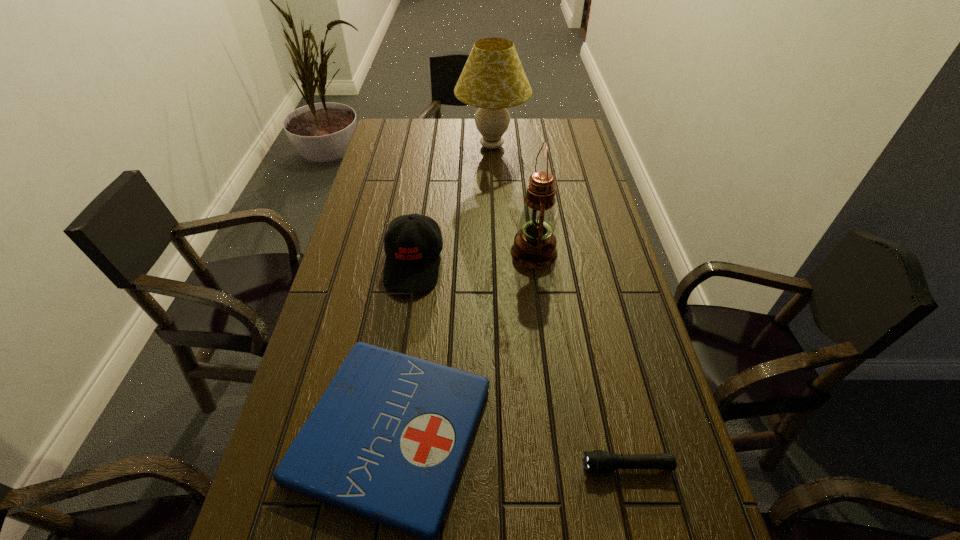
Identify the location of vacant space that's between the oil lamp and the lampshade. (513, 199).

In order to click on object that is the fourth closest to the third tallest object in this screenshot , I will do `click(598, 461)`.

The height and width of the screenshot is (540, 960). Find the location of `the fourth closest object to the flashlight`. the fourth closest object to the flashlight is located at coordinates (493, 79).

At what (x,y) coordinates should I click in order to perform the action: click on blank area in the image that satisfies the following two spatial constraints: 1. on the front side of the farthest object; 2. on the right side of the oil lamp. Please return your answer as a coordinate pair (x, y). This screenshot has height=540, width=960. Looking at the image, I should click on (495, 252).